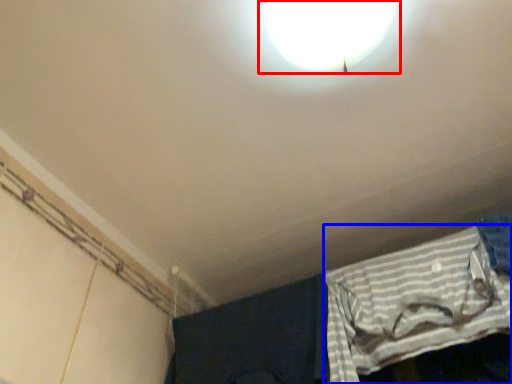
Question: Which object appears closest to the camera in this image, lamp (highlighted by a red box) or curtain (highlighted by a blue box)?

Choices:
 (A) lamp
 (B) curtain

Answer: (A)